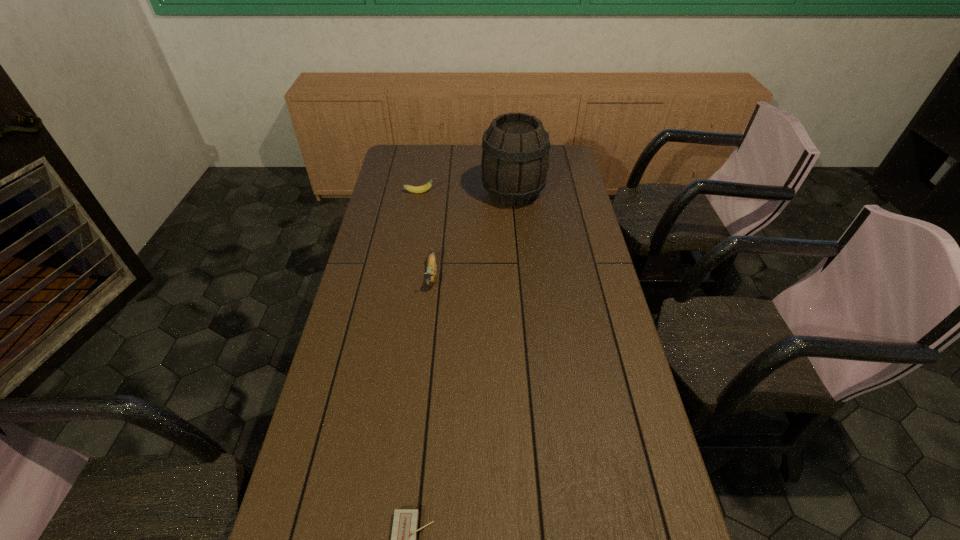
Where is `object that is at the right edge`? The width and height of the screenshot is (960, 540). object that is at the right edge is located at coordinates (515, 148).

Locate an element on the screen. Image resolution: width=960 pixels, height=540 pixels. vacant space at the left edge of the desktop is located at coordinates tap(349, 362).

Where is `blank space at the right edge`? The image size is (960, 540). blank space at the right edge is located at coordinates (550, 226).

The image size is (960, 540). In the image, there is a desktop. Find the location of `blank space at the far right corner`. blank space at the far right corner is located at coordinates (557, 150).

The width and height of the screenshot is (960, 540). Identify the location of vacant area between the taller banana and the shorter banana. (426, 234).

Find the location of a particular element. vacant point located between the tallest object and the shorter banana is located at coordinates (467, 193).

At what (x,y) coordinates should I click in order to perform the action: click on vacant area that lies between the rightmost object and the second nearest object. Please return your answer as a coordinate pair (x, y). Image resolution: width=960 pixels, height=540 pixels. Looking at the image, I should click on (472, 234).

Where is `vacant point located between the wine bucket and the third tallest object`? vacant point located between the wine bucket and the third tallest object is located at coordinates (467, 193).

In order to click on object that is the third nearest to the shortest object in this screenshot , I will do `click(419, 189)`.

This screenshot has height=540, width=960. What are the coordinates of `object that is the second closest one to the shorter banana` in the screenshot? It's located at [x=431, y=274].